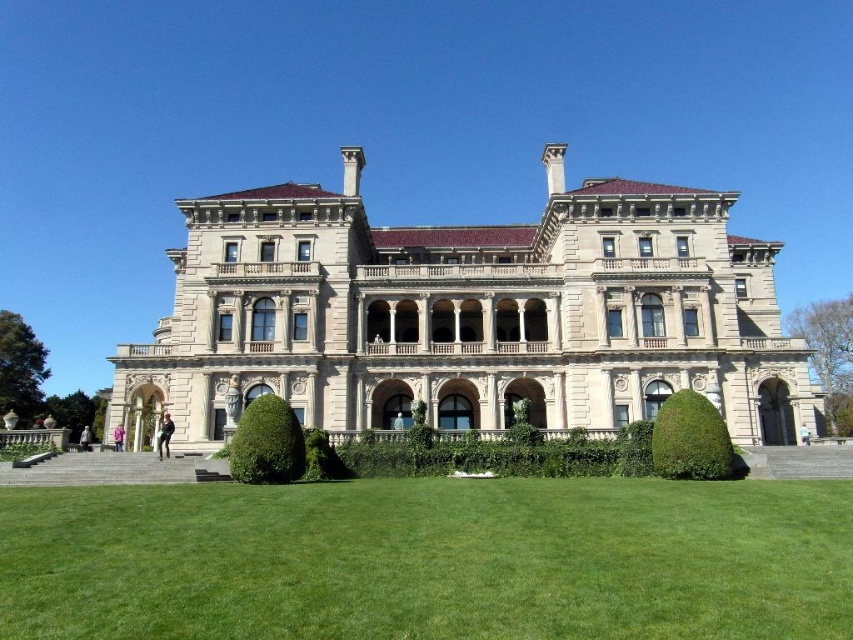
You are a photographer planning to capture the beige stone mansion at center and the green leafy hedge at lower right in a single frame. Based on their sizes, which object should you focus on to ensure both are clearly visible in the photo?

The beige stone mansion at center is larger than the green leafy hedge at lower right, so focusing on the mansion will help ensure both are clearly visible in the photo.

You are a gardener planning to mow the green grass at lower center and trim the green leafy hedge at center. Which area requires more horizontal space for your equipment to maneuver?

The green grass at lower center might be wider than the green leafy hedge at center, so the grass area likely requires more horizontal space for equipment maneuvering.

You are a gardener planning to mow the lawn. You see the green grass at lower center and the green leafy hedge at center. Which area requires mowing? Please explain your reasoning based on their sizes.

The green grass at lower center requires mowing because it has a larger size compared to the green leafy hedge at center, indicating it is the lawn area needing maintenance.